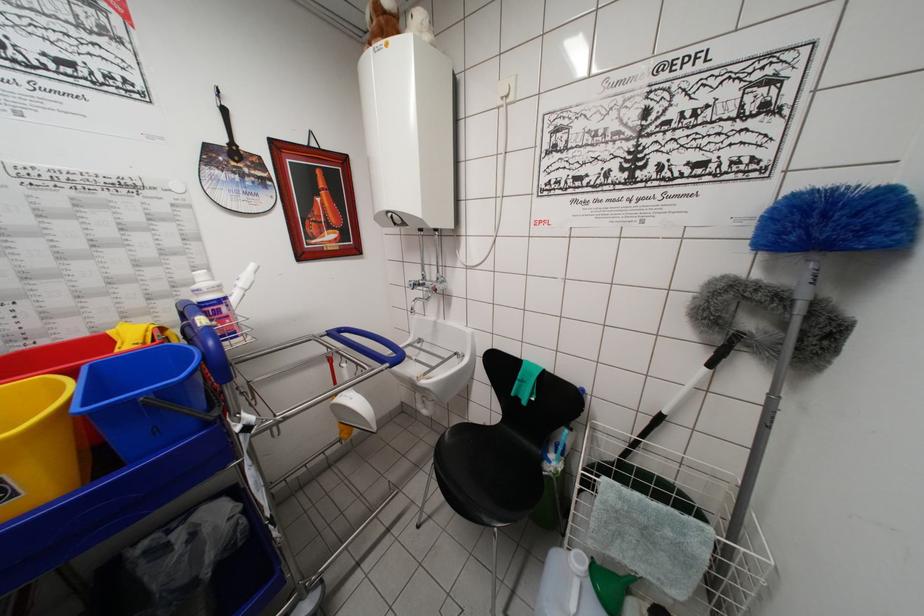
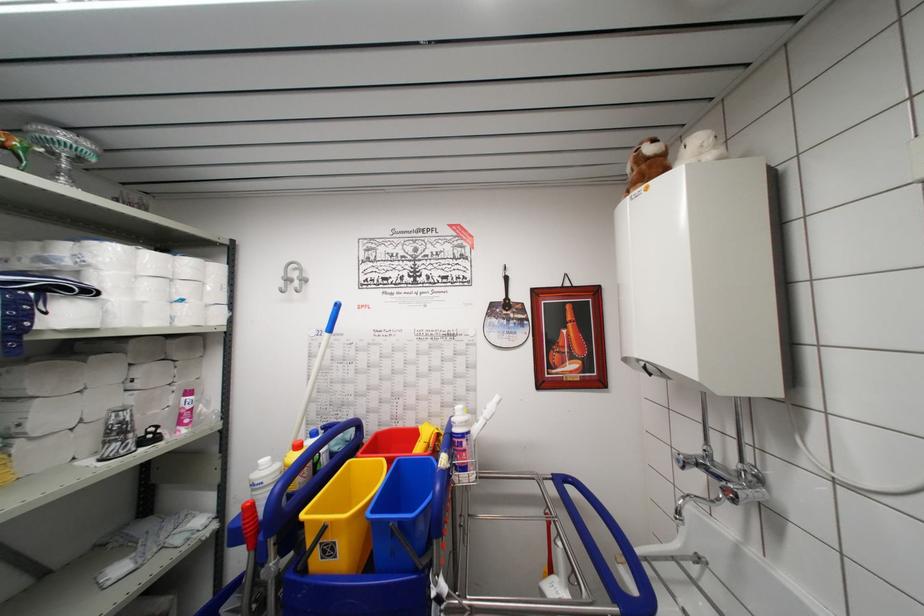
Locate, in the second image, the point that corresponds to the point at 95,370 in the first image.

(402, 466)